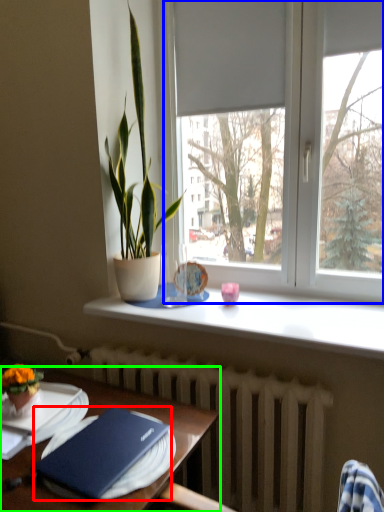
Question: Based on their relative distances, which object is nearer to hardback book (highlighted by a red box)? Choose from window (highlighted by a blue box) and table (highlighted by a green box).

Choices:
 (A) window
 (B) table

Answer: (B)